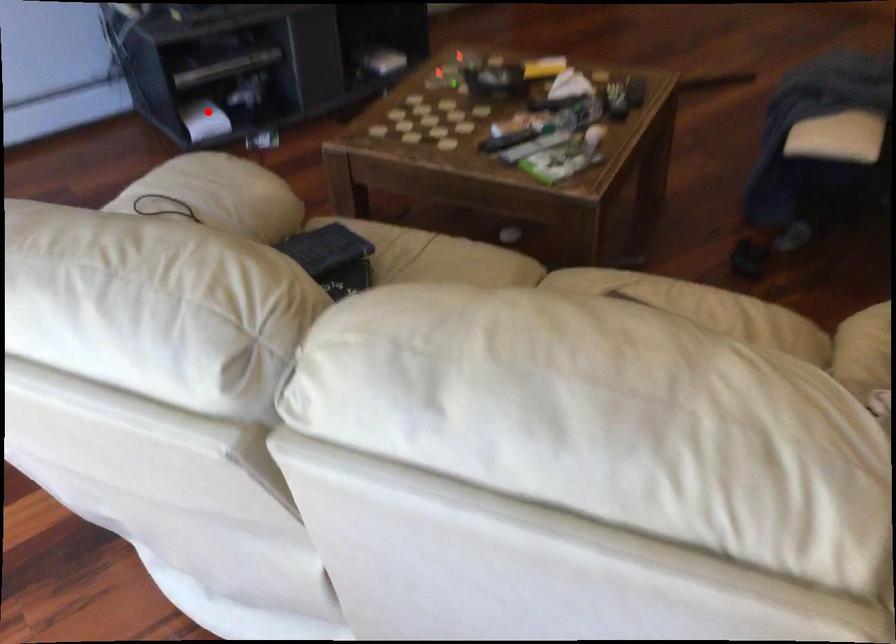
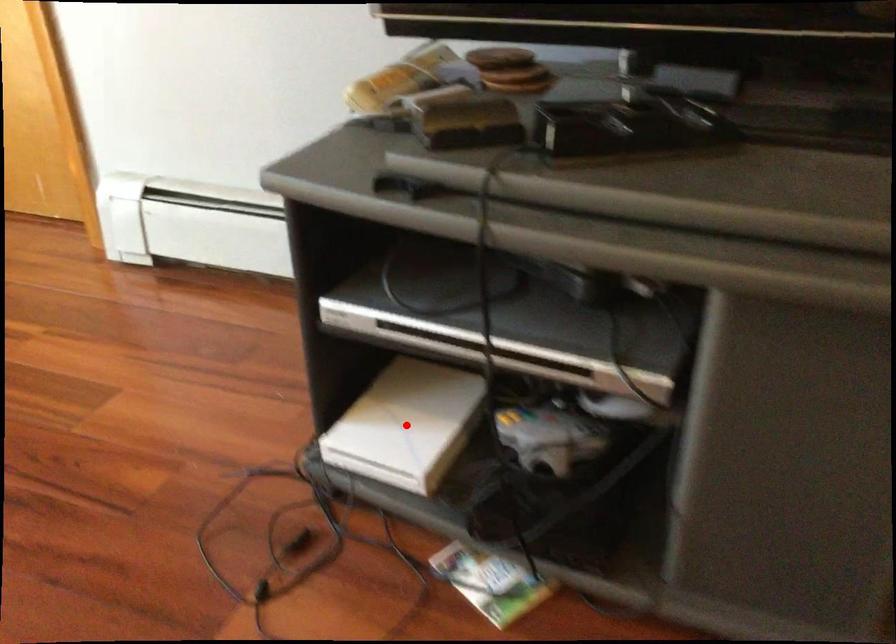
I am providing you with two images of the same scene from different viewpoints. A red point is marked on the first image and another point is marked on the second image. Do the highlighted points in image1 and image2 indicate the same real-world spot?

Yes